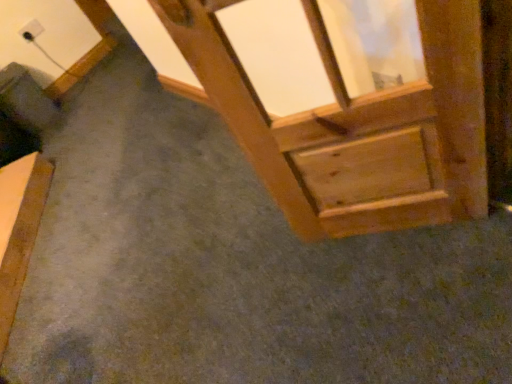
Question: Does point (20, 36) appear closer or farther from the camera than point (422, 144)?

Choices:
 (A) farther
 (B) closer

Answer: (A)

Question: Would you say white plastic outlet at upper left is inside or outside wooden frame at upper right?

Choices:
 (A) outside
 (B) inside

Answer: (A)

Question: Based on their relative distances, which object is farther from the wooden bed frame at lower left?

Choices:
 (A) wooden frame at upper right
 (B) white plastic outlet at upper left

Answer: (A)

Question: Which object is the farthest from the wooden bed frame at lower left?

Choices:
 (A) white plastic outlet at upper left
 (B) wooden frame at upper right

Answer: (B)